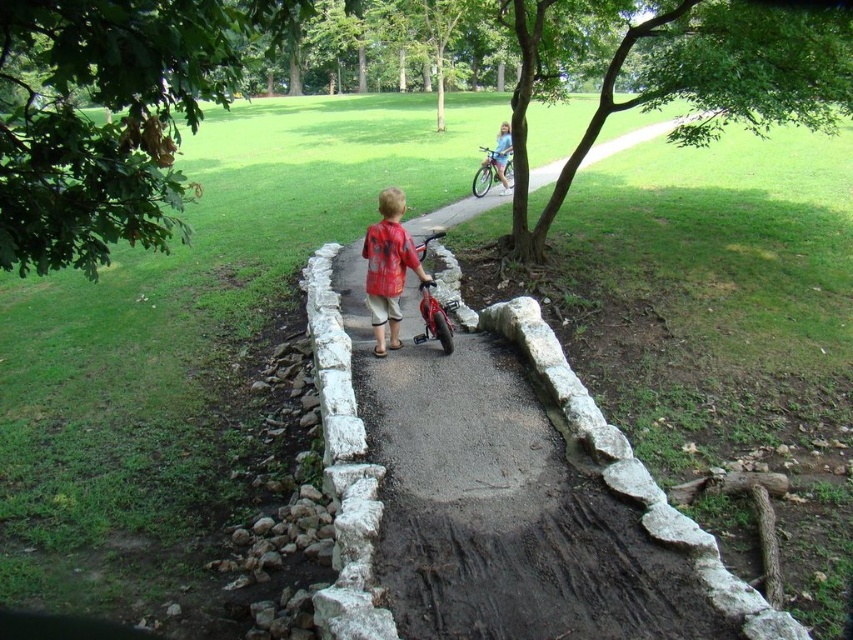
Between red matte shirt at center and shiny red bicycle at center, which one appears on the right side from the viewer's perspective?

Positioned to the right is shiny red bicycle at center.

Find the location of a particular element. The image size is (853, 640). red matte shirt at center is located at coordinates (387, 268).

Does point (567, 465) come behind point (425, 323)?

No.

Where is `smooth concrete path at center`? smooth concrete path at center is located at coordinates (502, 506).

Does green leafy tree at upper left have a smaller size compared to green leafy tree at upper right?

No.

Who is positioned more to the right, green leafy tree at upper left or green leafy tree at upper right?

green leafy tree at upper right is more to the right.

Is point (78, 208) positioned before point (816, 109)?

Yes.

This screenshot has width=853, height=640. Find the location of `green leafy tree at upper left`. green leafy tree at upper left is located at coordinates (109, 118).